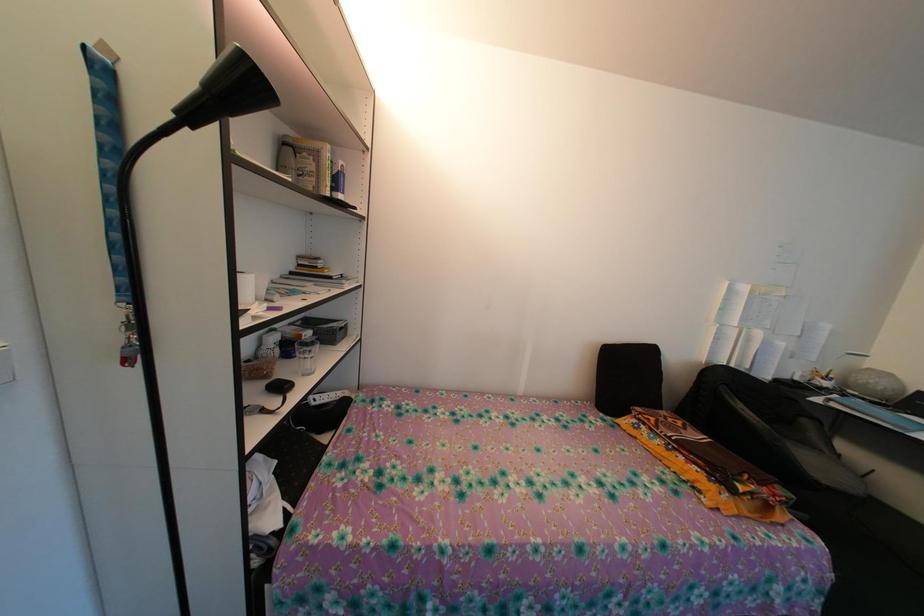
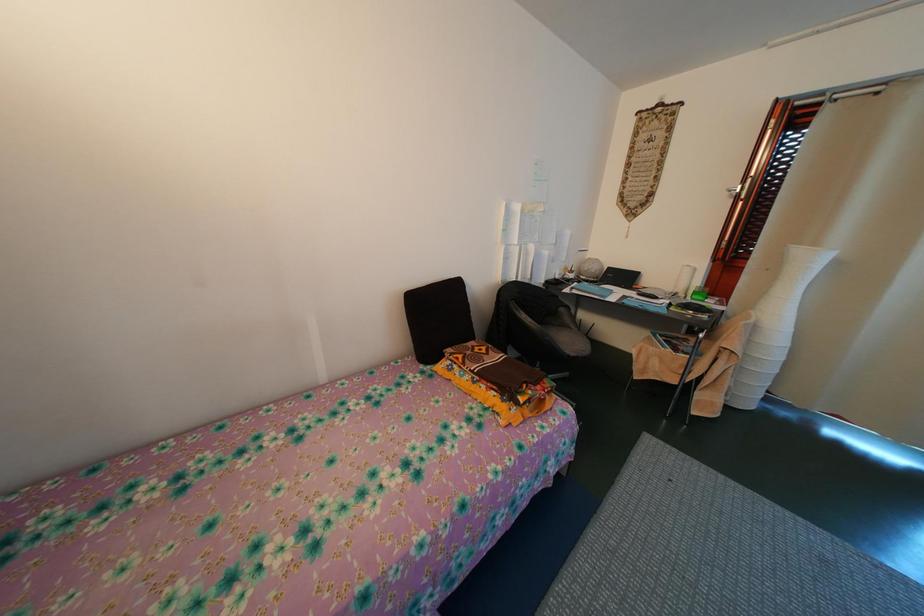
Question: Based on the continuous images, in which direction is the camera rotating? Reply with the corresponding letter.

Choices:
 (A) Left
 (B) Right
 (C) Up
 (D) Down

Answer: (B)